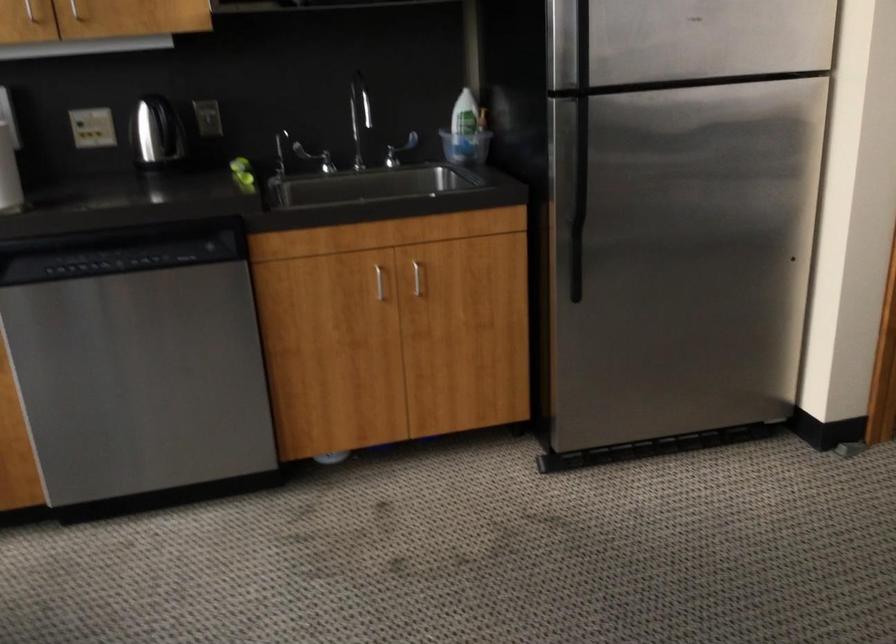
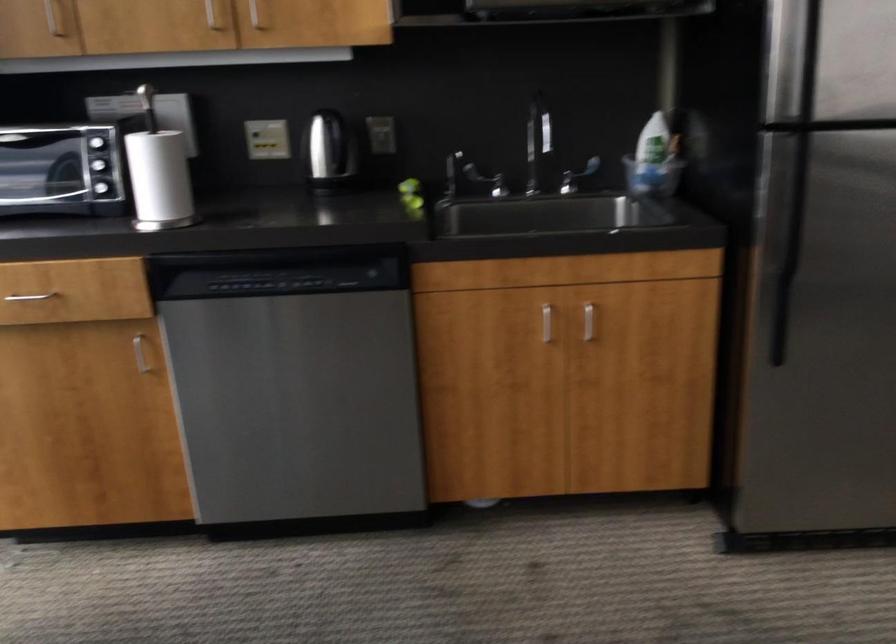
Locate, in the second image, the point that corresponds to (x=418, y=279) in the first image.

(588, 321)